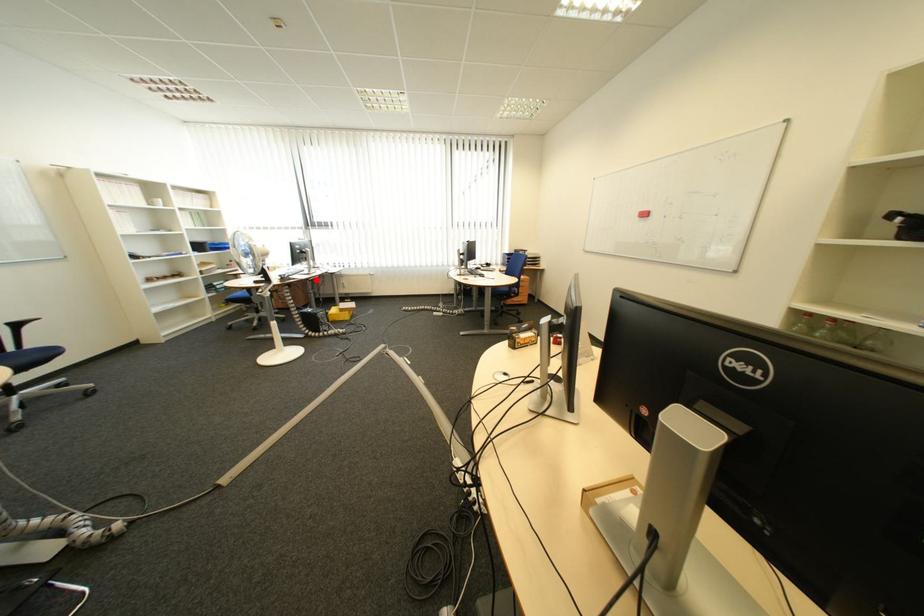
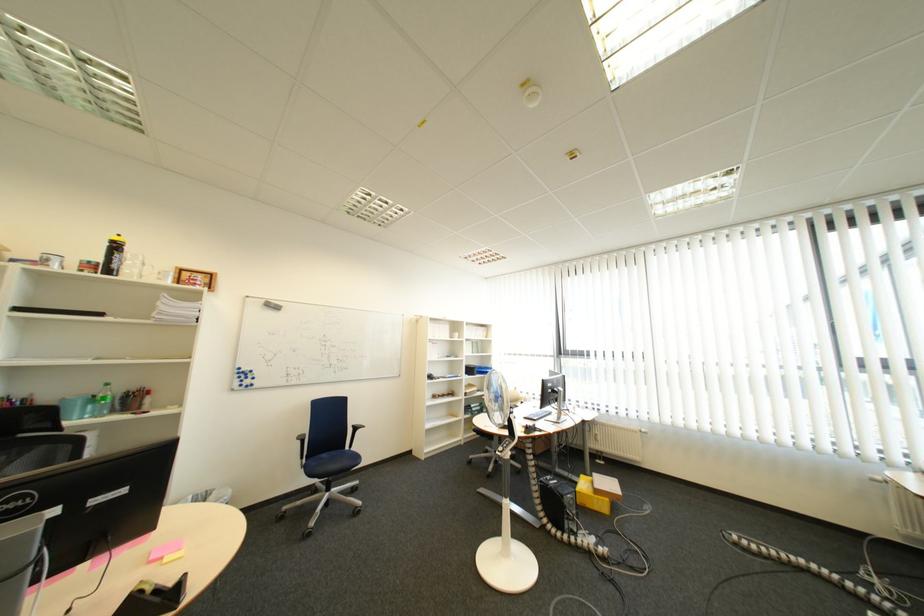
In the second image, find the point that corresponds to the highlighted location in the first image.

(565, 434)